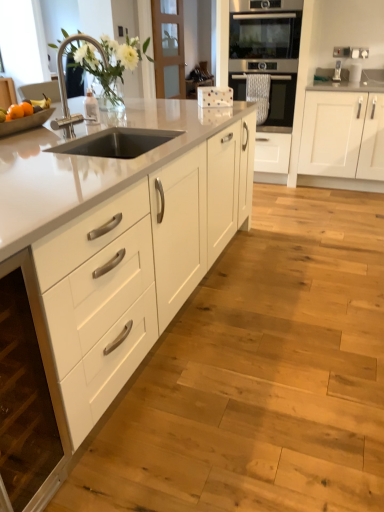
Measure the distance between orange matte at left, the first orange in the front-to-back sequence, and camera.

orange matte at left, the first orange in the front-to-back sequence, and camera are 6.28 feet apart from each other.

Image resolution: width=384 pixels, height=512 pixels. What are the coordinates of `stainless steel oven at center, which is the 1th oven in bottom-to-top order` in the screenshot? It's located at (281, 100).

What do you see at coordinates (342, 135) in the screenshot?
I see `white matte cabinet at right, which is the 3th cabinetry in left-to-right order` at bounding box center [342, 135].

In order to face white matte cabinet at right, which is the first cabinetry from right to left, should I rotate leftwards or rightwards?

Turn right by 20.413 degrees to look at white matte cabinet at right, which is the first cabinetry from right to left.

Locate an element on the screen. The image size is (384, 512). stainless steel oven at center, which appears as the 1th oven when viewed from the top is located at coordinates (267, 53).

Locate an element on the screen. The image size is (384, 512). silver metallic faucet at upper left is located at coordinates (65, 85).

Is satin silver sink at upper left not near white glossy cabinets at center, the 1th cabinetry viewed from the left?

satin silver sink at upper left is actually quite close to white glossy cabinets at center, the 1th cabinetry viewed from the left.

The width and height of the screenshot is (384, 512). Find the location of `sink that appears on the right of white glossy cabinets at center, the 1th cabinetry viewed from the left`. sink that appears on the right of white glossy cabinets at center, the 1th cabinetry viewed from the left is located at coordinates (103, 60).

Which is nearer, (162, 138) or (220, 187)?

The point (162, 138) is closer.

What's the angular difference between orange matte at left, the first orange in the front-to-back sequence, and white matte cabinet at right, which is the first cabinetry from right to left,'s facing directions?

The facing directions of orange matte at left, the first orange in the front-to-back sequence, and white matte cabinet at right, which is the first cabinetry from right to left, are 90.2 degrees apart.

In the scene shown: Is orange matte at left, the first orange in the front-to-back sequence, positioned behind white matte cabinet at right, which is the first cabinetry from right to left?

No, it is in front of white matte cabinet at right, which is the first cabinetry from right to left.

Is orange matte at left, acting as the second orange starting from the back, positioned far away from white matte cabinet at right, which is the 3th cabinetry in left-to-right order?

Yes, orange matte at left, acting as the second orange starting from the back, and white matte cabinet at right, which is the 3th cabinetry in left-to-right order, are located far from each other.

Could you tell me if orange matte at left, acting as the second orange starting from the back, is turned towards white matte cabinet at right, which is the first cabinetry from right to left?

No, orange matte at left, acting as the second orange starting from the back, is not facing towards white matte cabinet at right, which is the first cabinetry from right to left.

Which is behind, satin silver sink at upper left or stainless steel oven at center, which appears as the 1th oven when viewed from the top?

stainless steel oven at center, which appears as the 1th oven when viewed from the top, is behind.

Can you tell me how much satin silver sink at upper left and stainless steel oven at center, positioned as the 2th oven in bottom-to-top order, differ in facing direction?

The angle between the facing direction of satin silver sink at upper left and the facing direction of stainless steel oven at center, positioned as the 2th oven in bottom-to-top order, is 98.1 degrees.

Considering the sizes of objects satin silver sink at upper left and stainless steel oven at center, which appears as the 1th oven when viewed from the top, in the image provided, who is shorter, satin silver sink at upper left or stainless steel oven at center, which appears as the 1th oven when viewed from the top,?

Standing shorter between the two is satin silver sink at upper left.

From a real-world perspective, is satin silver sink at upper left on stainless steel oven at center, positioned as the 2th oven in bottom-to-top order?

Correct, in the physical world, satin silver sink at upper left is higher than stainless steel oven at center, positioned as the 2th oven in bottom-to-top order.

Which object is further away from the camera taking this photo, white glossy cabinets at center, the 1th cabinetry viewed from the left, or stainless steel oven at center, which is the 1th oven in bottom-to-top order?

stainless steel oven at center, which is the 1th oven in bottom-to-top order.

Does white glossy cabinets at center, arranged as the third cabinetry when viewed from the right, turn towards stainless steel oven at center, which is the 1th oven in bottom-to-top order?

No, white glossy cabinets at center, arranged as the third cabinetry when viewed from the right, does not turn towards stainless steel oven at center, which is the 1th oven in bottom-to-top order.

From a real-world perspective, between white glossy cabinets at center, arranged as the third cabinetry when viewed from the right, and stainless steel oven at center, the 2th oven viewed from the top, who is vertically higher?

stainless steel oven at center, the 2th oven viewed from the top.

Considering the sizes of objects white glossy cabinets at center, the 1th cabinetry viewed from the left, and stainless steel oven at center, the 2th oven viewed from the top, in the image provided, who is wider, white glossy cabinets at center, the 1th cabinetry viewed from the left, or stainless steel oven at center, the 2th oven viewed from the top,?

white glossy cabinets at center, the 1th cabinetry viewed from the left.

Would you say orange matte at left, acting as the second orange starting from the back, is outside white matte cabinet at lower left, which appears as the second cabinetry when viewed from the left?

orange matte at left, acting as the second orange starting from the back, is positioned outside white matte cabinet at lower left, which appears as the second cabinetry when viewed from the left.

Considering the relative positions of orange matte at left, acting as the second orange starting from the back, and white matte cabinet at lower left, which appears as the second cabinetry when viewed from the left, in the image provided, is orange matte at left, acting as the second orange starting from the back, to the left or to the right of white matte cabinet at lower left, which appears as the second cabinetry when viewed from the left,?

orange matte at left, acting as the second orange starting from the back, is to the left of white matte cabinet at lower left, which appears as the second cabinetry when viewed from the left.

From a real-world perspective, is orange matte at left, acting as the second orange starting from the back, over white matte cabinet at lower left, placed as the second cabinetry when sorted from right to left?

Correct, in the physical world, orange matte at left, acting as the second orange starting from the back, is higher than white matte cabinet at lower left, placed as the second cabinetry when sorted from right to left.

Which object is positioned more to the left, satin silver sink at upper left or silver metallic faucet at upper left?

satin silver sink at upper left.

Consider the image. Which point is more forward, (120, 70) or (50, 125)?

The point (50, 125) is closer.

Identify the location of sink behind the silver metallic faucet at upper left. (103, 60).

From a real-world perspective, is satin silver sink at upper left on top of silver metallic faucet at upper left?

Yes, from a real-world perspective, satin silver sink at upper left is over silver metallic faucet at upper left

Which object is closer to the camera, stainless steel oven at center, which appears as the 1th oven when viewed from the top, or white matte cabinet at right, which is the first cabinetry from right to left?

stainless steel oven at center, which appears as the 1th oven when viewed from the top.

Is stainless steel oven at center, which appears as the 1th oven when viewed from the top, thinner than white matte cabinet at right, which is the 3th cabinetry in left-to-right order?

Correct, the width of stainless steel oven at center, which appears as the 1th oven when viewed from the top, is less than that of white matte cabinet at right, which is the 3th cabinetry in left-to-right order.

Based on their positions, is stainless steel oven at center, positioned as the 2th oven in bottom-to-top order, located to the left or right of white matte cabinet at right, which is the first cabinetry from right to left?

From the image, it's evident that stainless steel oven at center, positioned as the 2th oven in bottom-to-top order, is to the left of white matte cabinet at right, which is the first cabinetry from right to left.

Identify the location of the 1st cabinetry below when counting from the satin silver sink at upper left (from the image's perspective). This screenshot has height=512, width=384. (119, 245).

The width and height of the screenshot is (384, 512). I want to click on cabinetry above the orange matte at left, the first orange in the front-to-back sequence (from the image's perspective), so click(342, 135).

Based on their spatial positions, is orange matte at left, the first orange in the front-to-back sequence, or white matte cabinet at right, which is the 3th cabinetry in left-to-right order, closer to satin silver sink at upper left?

orange matte at left, the first orange in the front-to-back sequence, is closer to satin silver sink at upper left.

Based on their spatial positions, is orange matte fruit at left, marked as the 1th orange in a back-to-front arrangement, or stainless steel oven at center, which is the 1th oven in bottom-to-top order, closer to satin silver sink at upper left?

Among the two, orange matte fruit at left, marked as the 1th orange in a back-to-front arrangement, is located nearer to satin silver sink at upper left.

Estimate the real-world distances between objects in this image. Which object is further from orange matte at left, acting as the second orange starting from the back, stainless steel oven at center, which appears as the 1th oven when viewed from the top, or silver metallic faucet at upper left?

stainless steel oven at center, which appears as the 1th oven when viewed from the top, is positioned further to the anchor orange matte at left, acting as the second orange starting from the back.

Based on their spatial positions, is silver metallic faucet at upper left or stainless steel oven at center, positioned as the 2th oven in bottom-to-top order, closer to orange matte fruit at left, marked as the 1th orange in a back-to-front arrangement?

silver metallic faucet at upper left is closer to orange matte fruit at left, marked as the 1th orange in a back-to-front arrangement.

Estimate the real-world distances between objects in this image. Which object is closer to white matte cabinet at right, which is the first cabinetry from right to left, satin silver sink at upper left or orange matte fruit at left, marked as the 1th orange in a back-to-front arrangement?

satin silver sink at upper left is positioned closer to the anchor white matte cabinet at right, which is the first cabinetry from right to left.

Estimate the real-world distances between objects in this image. Which object is closer to satin silver sink at upper left, stainless steel oven at center, positioned as the 2th oven in bottom-to-top order, or white matte cabinet at right, which is the 3th cabinetry in left-to-right order?

Based on the image, stainless steel oven at center, positioned as the 2th oven in bottom-to-top order, appears to be nearer to satin silver sink at upper left.

Which object lies further to the anchor point white glossy cabinets at center, arranged as the third cabinetry when viewed from the right, white matte cabinet at right, which is the 3th cabinetry in left-to-right order, or orange matte fruit at left, the second orange in the front-to-back sequence?

white matte cabinet at right, which is the 3th cabinetry in left-to-right order, is positioned further to the anchor white glossy cabinets at center, arranged as the third cabinetry when viewed from the right.

Looking at the image, which one is located closer to silver metallic faucet at upper left, orange matte fruit at left, marked as the 1th orange in a back-to-front arrangement, or satin silver sink at upper left?

Answer: satin silver sink at upper left is positioned closer to the anchor silver metallic faucet at upper left.

Find the location of a particular element. This screenshot has width=384, height=512. sink between white matte cabinet at lower left, placed as the second cabinetry when sorted from right to left, and white matte cabinet at right, which is the first cabinetry from right to left, along the z-axis is located at coordinates (103, 60).

In order to click on faucet positioned between white glossy cabinets at center, the 1th cabinetry viewed from the left, and stainless steel oven at center, which appears as the 1th oven when viewed from the top, from near to far in this screenshot , I will do `click(65, 85)`.

Locate an element on the screen. Image resolution: width=384 pixels, height=512 pixels. oven positioned between silver metallic faucet at upper left and stainless steel oven at center, which is the 1th oven in bottom-to-top order, from near to far is located at coordinates (267, 53).

Locate an element on the screen. Image resolution: width=384 pixels, height=512 pixels. faucet between white matte cabinet at lower left, which appears as the second cabinetry when viewed from the left, and stainless steel oven at center, which is the 1th oven in bottom-to-top order, in the front-back direction is located at coordinates (65, 85).